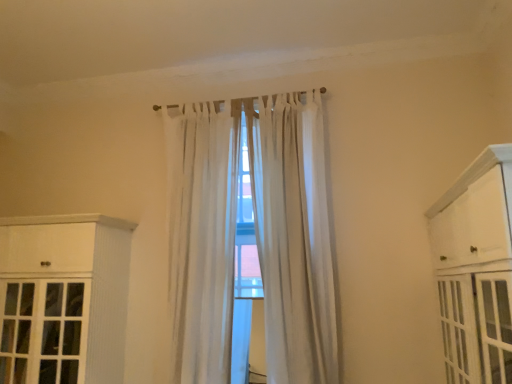
Question: Is white sheer curtain at center, the 1th curtain when ordered from left to right, bigger or smaller than white wood cabinet at left, which appears as the 2th cabinetry when viewed from the right?

Choices:
 (A) big
 (B) small

Answer: (B)

Question: Would you say white sheer curtain at center, which ranks as the 2th curtain in right-to-left order, is to the left or to the right of white wood cabinet at left, which is counted as the 2th cabinetry, starting from the front, in the picture?

Choices:
 (A) left
 (B) right

Answer: (B)

Question: Estimate the real-world distances between objects in this image. Which object is farther from the white sheer curtain at center, placed as the second curtain when sorted from left to right?

Choices:
 (A) white painted wood cabinet at right, arranged as the 2th cabinetry when viewed from the back
 (B) white sheer curtain at center, the 1th curtain when ordered from left to right
 (C) white wood cabinet at left, which appears as the 2th cabinetry when viewed from the right

Answer: (A)

Question: Based on their relative distances, which object is farther from the white sheer curtain at center, placed as the second curtain when sorted from left to right?

Choices:
 (A) white wood cabinet at left, the first cabinetry when ordered from left to right
 (B) white sheer curtain at center, the 1th curtain when ordered from left to right
 (C) white painted wood cabinet at right, positioned as the 1th cabinetry in right-to-left order

Answer: (C)